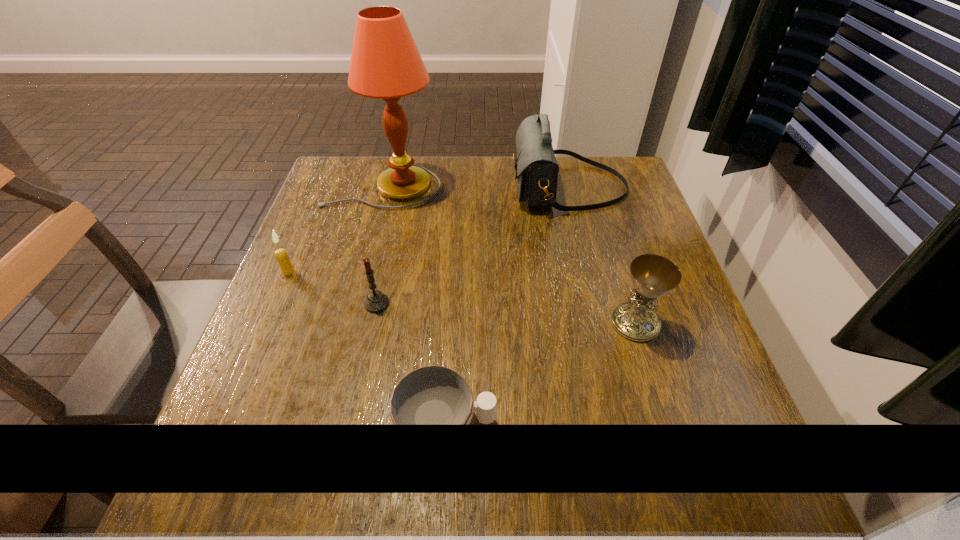
You are a GUI agent. You are given a task and a screenshot of the screen. Output one action in this format:
    pyautogui.click(x=<x>, y=<y>)
    Task: Click on the tallest object
    
    Given the screenshot: What is the action you would take?
    pyautogui.click(x=385, y=64)

Find the location of `shoulder bag`. shoulder bag is located at coordinates (536, 167).

Find the location of a particular element. Image resolution: width=960 pixels, height=540 pixels. chalice is located at coordinates (653, 276).

I want to click on the right candle, so click(376, 302).

Image resolution: width=960 pixels, height=540 pixels. What are the coordinates of `the farther candle` in the screenshot? It's located at (281, 255).

Locate an element on the screen. The width and height of the screenshot is (960, 540). the third farthest object is located at coordinates (281, 255).

This screenshot has height=540, width=960. In order to click on the shortest object in this screenshot , I will do `click(433, 395)`.

In order to click on the nearest object in this screenshot , I will do pos(433,395).

This screenshot has width=960, height=540. What are the coordinates of `vacant space located 0.280m on the right of the lamp` in the screenshot? It's located at (544, 186).

Locate an element on the screen. free space located 0.130m on the front of the second tallest object is located at coordinates (585, 254).